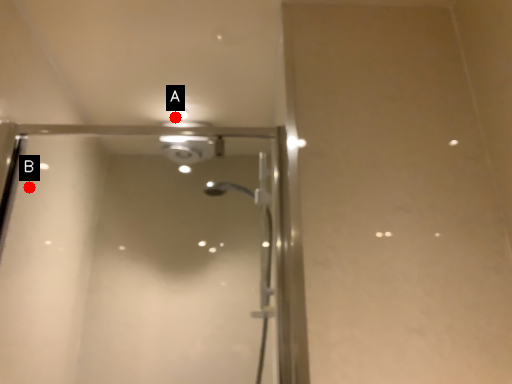
Question: Two points are circled on the image, labeled by A and B beside each circle. Which point is farther from the camera taking this photo?

Choices:
 (A) A is further
 (B) B is further

Answer: (A)